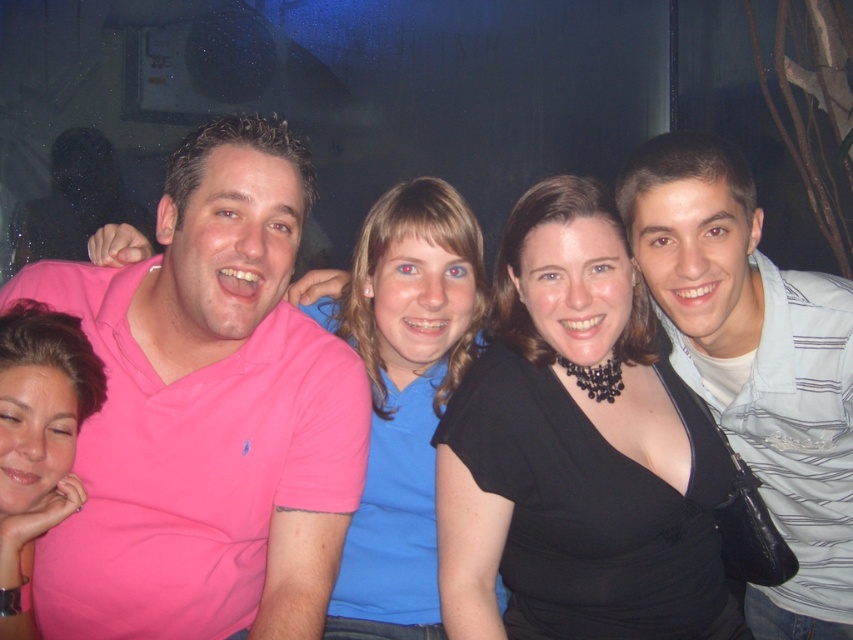
Does pink cotton shirt at left appear under matte pink shirt at lower left?

No, pink cotton shirt at left is not below matte pink shirt at lower left.

Between pink cotton shirt at left and matte pink shirt at lower left, which one has less height?

With less height is matte pink shirt at lower left.

Measure the distance between point (242, 122) and camera.

Point (242, 122) and camera are 4.33 feet apart.

Find the location of a particular element. The height and width of the screenshot is (640, 853). pink cotton shirt at left is located at coordinates (207, 413).

Which is more to the left, light blue striped shirt at right or blue matte shirt at center?

blue matte shirt at center

Is light blue striped shirt at right closer to camera compared to blue matte shirt at center?

Yes, light blue striped shirt at right is closer to the viewer.

Does point (643, 154) come behind point (469, 230)?

No.

The image size is (853, 640). I want to click on light blue striped shirt at right, so click(755, 362).

Measure the distance between black matte necklace at center and matte pink shirt at lower left.

black matte necklace at center is 26.34 inches away from matte pink shirt at lower left.

Which is behind, point (602, 609) or point (19, 490)?

Positioned behind is point (602, 609).

The width and height of the screenshot is (853, 640). I want to click on black matte necklace at center, so click(x=578, y=449).

This screenshot has width=853, height=640. Identify the location of black matte necklace at center. (578, 449).